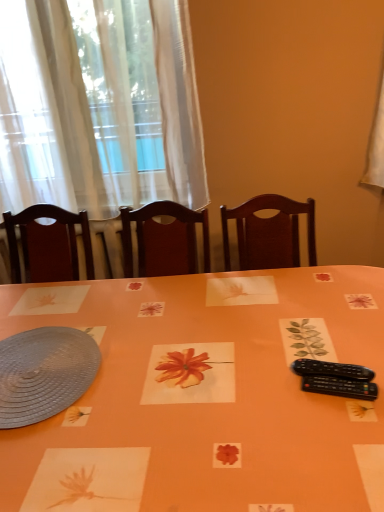
Question: Looking at the image, does black plastic remote at lower right seem bigger or smaller compared to orange paper placemat at center?

Choices:
 (A) small
 (B) big

Answer: (A)

Question: Looking at their shapes, would you say black plastic remote at lower right is wider or thinner than orange paper placemat at center?

Choices:
 (A) thin
 (B) wide

Answer: (A)

Question: Considering the real-world distances, which object is closest to the orange paper placemat at center?

Choices:
 (A) black plastic remote at lower right
 (B) white sheer curtain at upper left
 (C) matte gray platter at lower left

Answer: (C)

Question: Based on their relative distances, which object is farther from the white sheer curtain at upper left?

Choices:
 (A) matte gray platter at lower left
 (B) orange paper placemat at center
 (C) black plastic remote at lower right

Answer: (C)